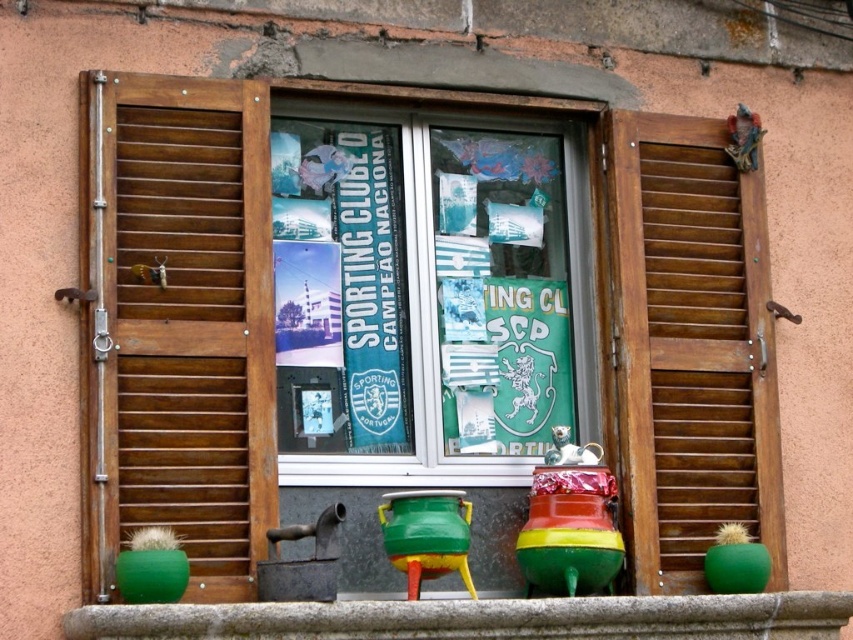
In the scene shown: You are an interior designer assessing the symmetry of the window shutters. Which of the wooden slats at left and wooden at right is smaller in size?

The wooden slats at left has a smaller size compared to wooden at right.

You are a window cleaner and need to determine which object is narrower between the wooden slats at left and the green ceramic pot at lower center. Which one is narrower?

The wooden slats at left are narrower than the green ceramic pot at lower center because the wooden slats at left have a smaller width compared to the green ceramic pot at lower center.

You are a delivery person trying to deliver a package to the address shown in the image. The package is 10 feet long and needs to be placed between the wooden slats at left. Can you fit the package between them?

The wooden slats at left are 103.62 feet apart, so the package that is 10 feet long can easily fit between them.